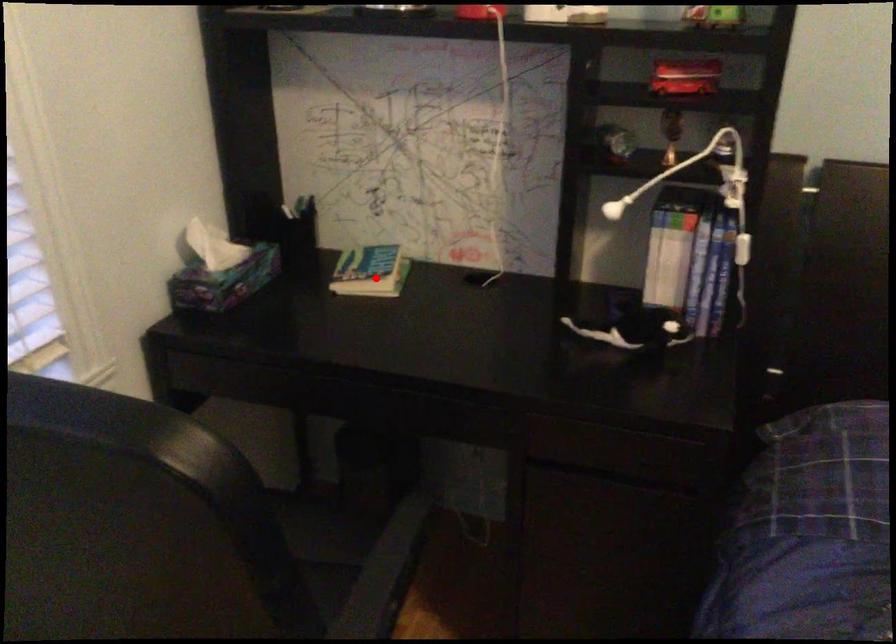
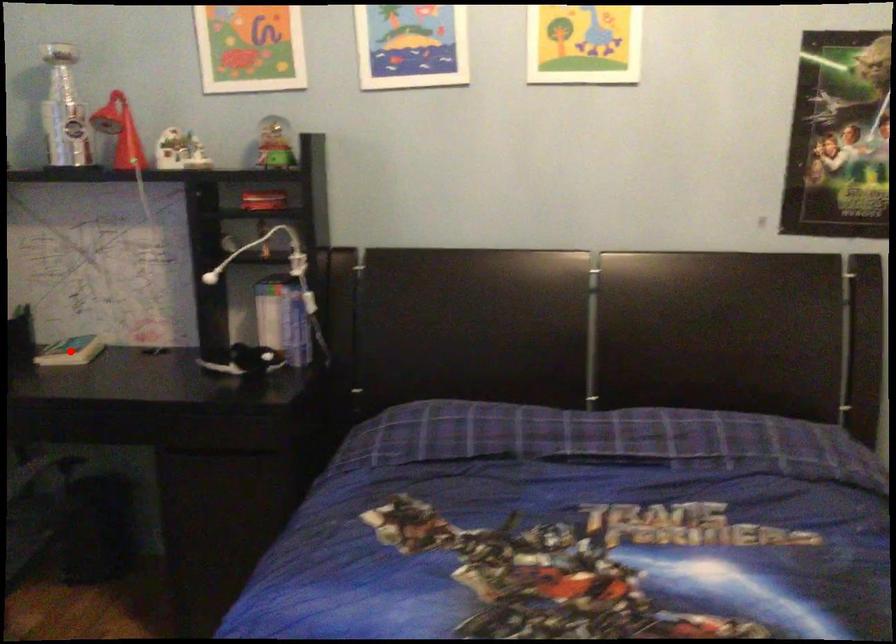
I am providing you with two images of the same scene from different viewpoints. A red point is marked on the first image and another point is marked on the second image. Is the marked point in image1 the same physical position as the marked point in image2?

Yes